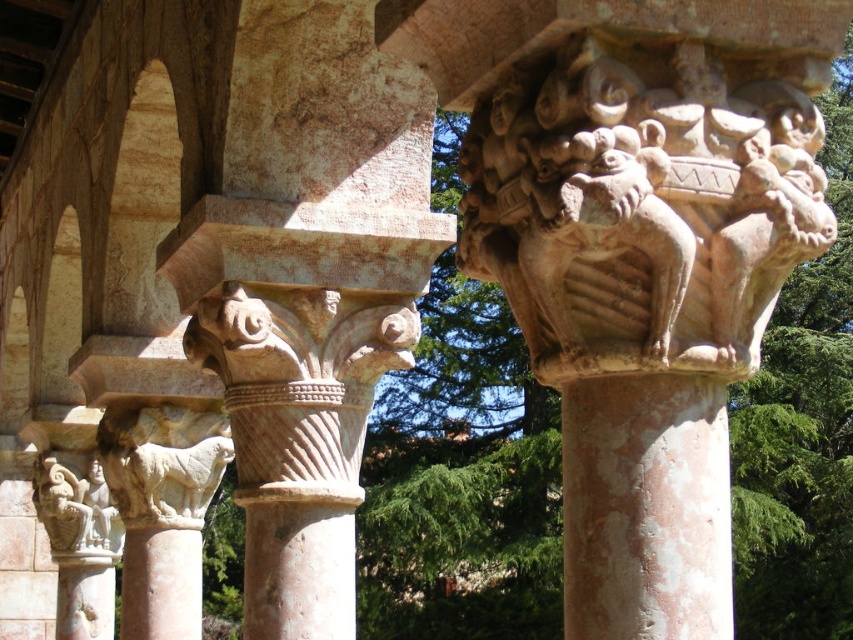
Who is taller, pink stone column at center or white stone statue at lower left?

Standing taller between the two is pink stone column at center.

Describe the element at coordinates (646, 508) in the screenshot. I see `pink stone column at center` at that location.

Who is more distant from viewer, (x=610, y=464) or (x=54, y=502)?

Point (x=54, y=502)

You are a GUI agent. You are given a task and a screenshot of the screen. Output one action in this format:
    pyautogui.click(x=<x>, y=<y>)
    Task: Click on the pink stone column at center
    Image resolution: width=853 pixels, height=640 pixels.
    Given the screenshot: What is the action you would take?
    pyautogui.click(x=646, y=508)

Who is taller, beige stone sculpture at center or pink stone column at center?

With more height is pink stone column at center.

Is beige stone sculpture at center thinner than pink stone column at center?

Yes.

I want to click on beige stone sculpture at center, so click(640, 209).

The height and width of the screenshot is (640, 853). What are the coordinates of `beige stone sculpture at center` in the screenshot? It's located at (640, 209).

Is beige stone sculpture at center taller than white stone statue at lower left?

No.

Can you confirm if beige stone sculpture at center is wider than white stone statue at lower left?

Incorrect, beige stone sculpture at center's width does not surpass white stone statue at lower left's.

Is point (785, 257) behind point (83, 556)?

No, (785, 257) is in front of (83, 556).

At what (x,y) coordinates should I click in order to perform the action: click on beige stone sculpture at center. Please return your answer as a coordinate pair (x, y). Image resolution: width=853 pixels, height=640 pixels. Looking at the image, I should click on (640, 209).